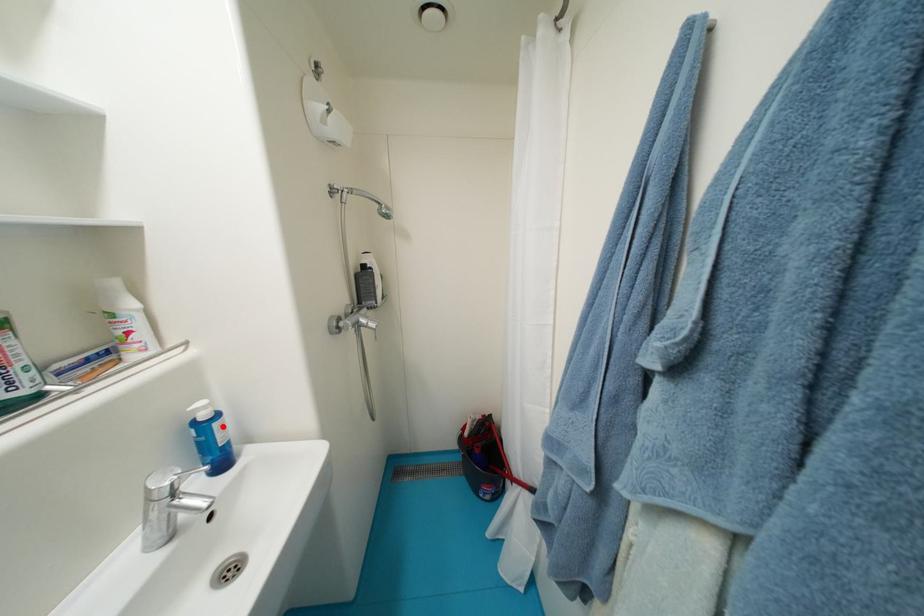
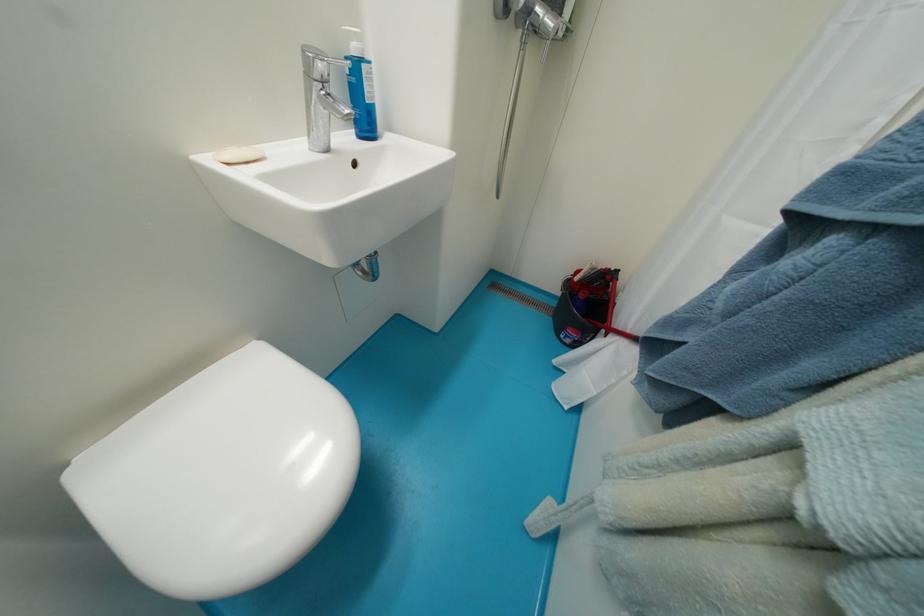
Locate, in the second image, the point that corresponds to the highlighted location in the first image.

(371, 70)